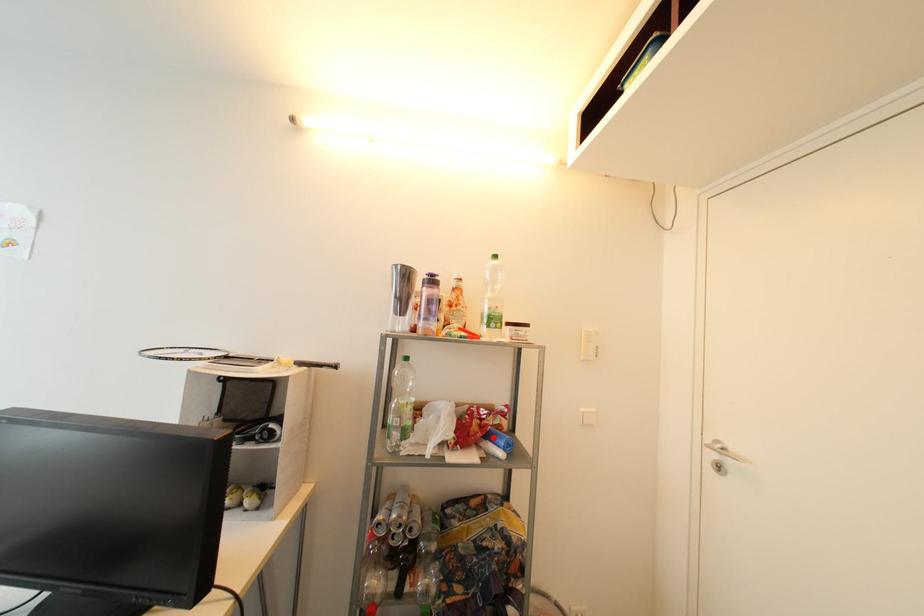
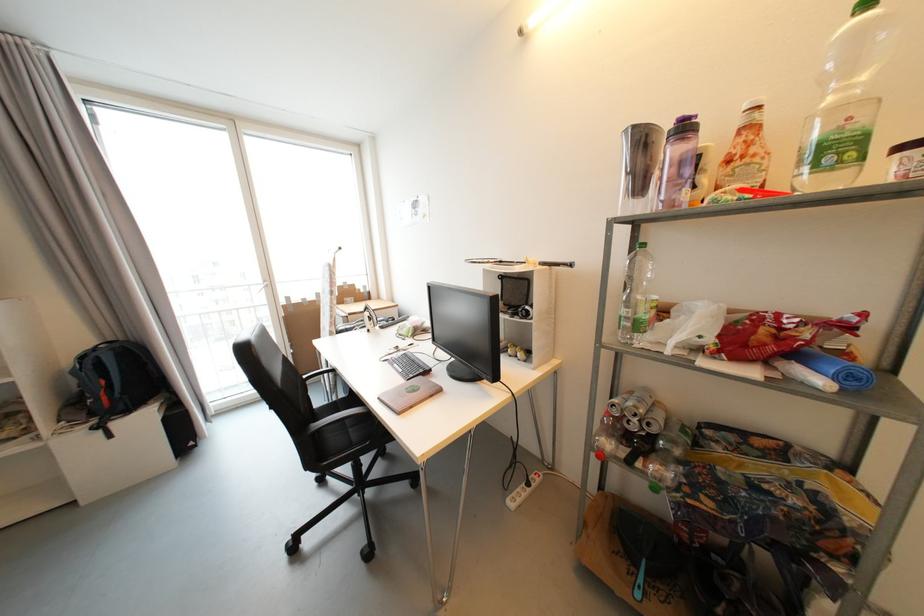
Where in the second image is the point corresponding to the highlighted location from the first image?

(801, 357)